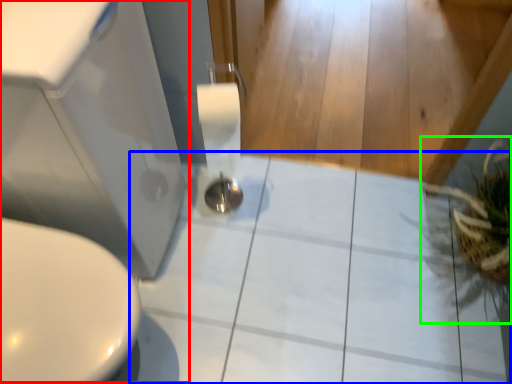
Question: Which is nearer to the sink (highlighted by a red box)? ceramic tile (highlighted by a blue box) or plant (highlighted by a green box).

Choices:
 (A) ceramic tile
 (B) plant

Answer: (A)